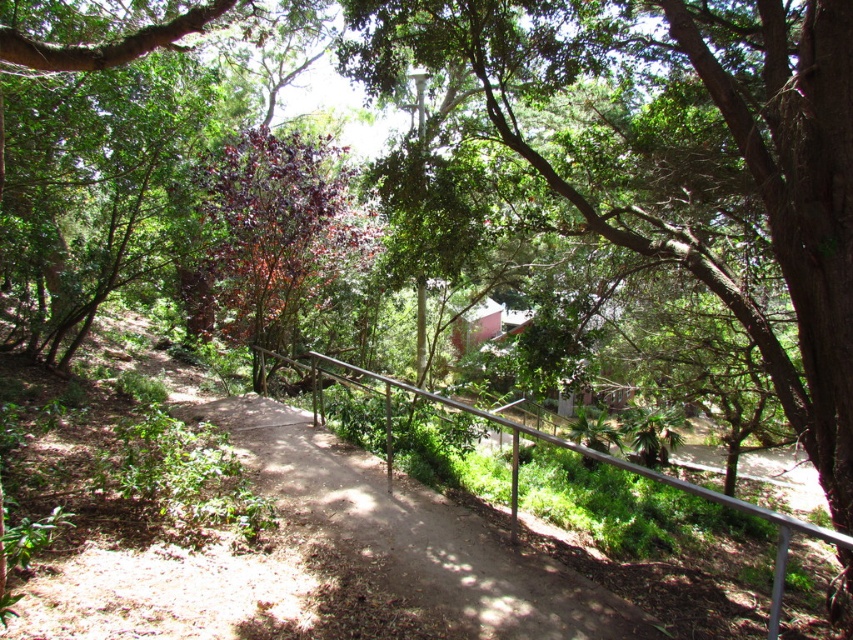
Question: Which point is farther from the camera taking this photo?

Choices:
 (A) pos(422,396)
 (B) pos(276,246)

Answer: (B)

Question: Among these objects, which one is nearest to the camera?

Choices:
 (A) silver metallic railing at center
 (B) purple-leaved tree at center

Answer: (A)

Question: Does purple-leaved tree at center come behind silver metallic railing at center?

Choices:
 (A) yes
 (B) no

Answer: (A)

Question: Can you confirm if purple-leaved tree at center is bigger than silver metallic railing at center?

Choices:
 (A) no
 (B) yes

Answer: (A)

Question: Can you confirm if purple-leaved tree at center is positioned above silver metallic railing at center?

Choices:
 (A) no
 (B) yes

Answer: (B)